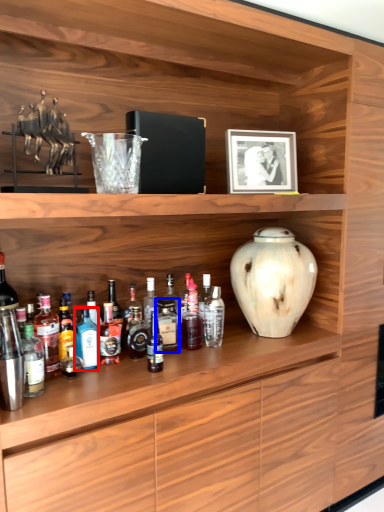
Question: Which object is closer to the camera taking this photo, bottle (highlighted by a red box) or bottle (highlighted by a blue box)?

Choices:
 (A) bottle
 (B) bottle

Answer: (A)